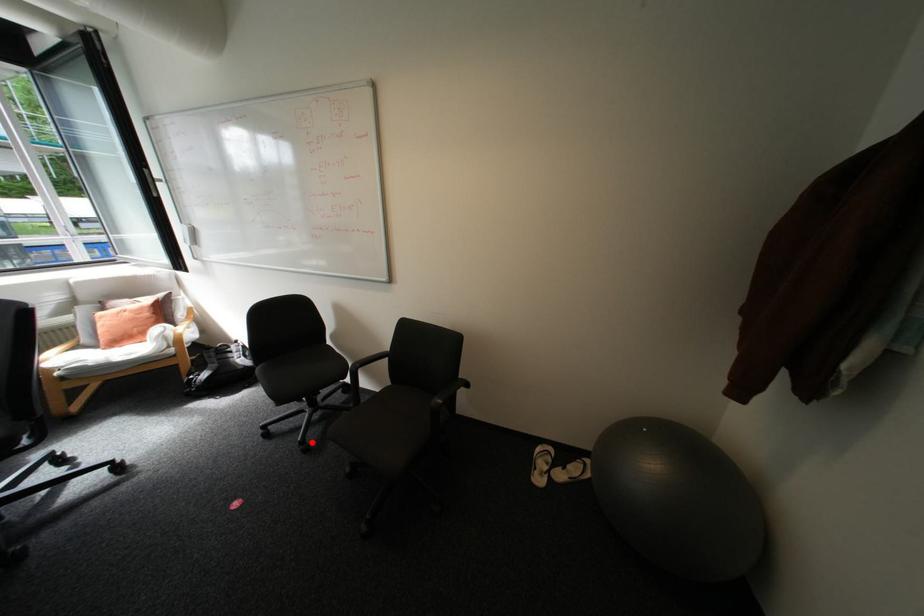
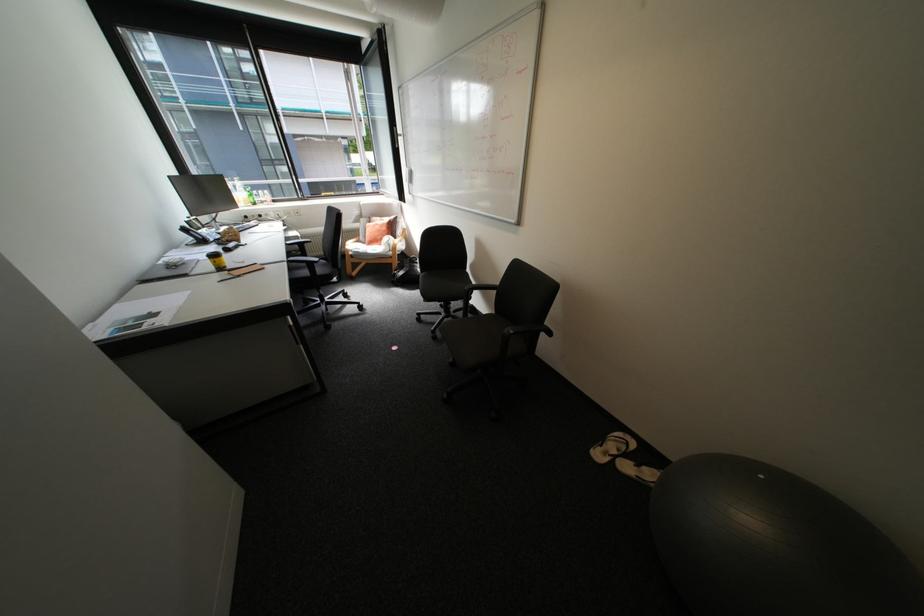
Question: I am providing you with two images of the same scene from different viewpoints. A red point is shown in image1. For the corresponding object point in image2, is it positioned nearer or farther from the camera?

Choices:
 (A) Nearer
 (B) Farther

Answer: (A)